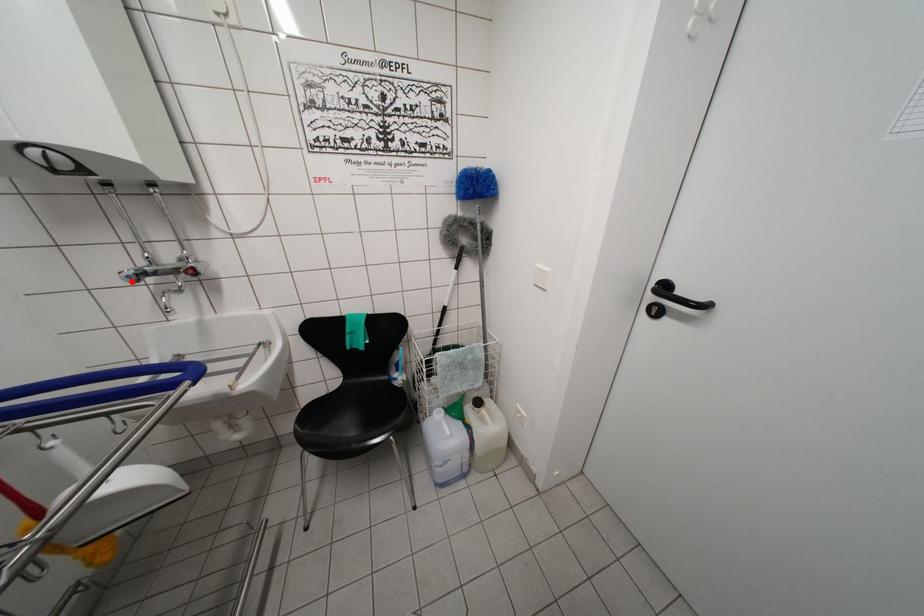
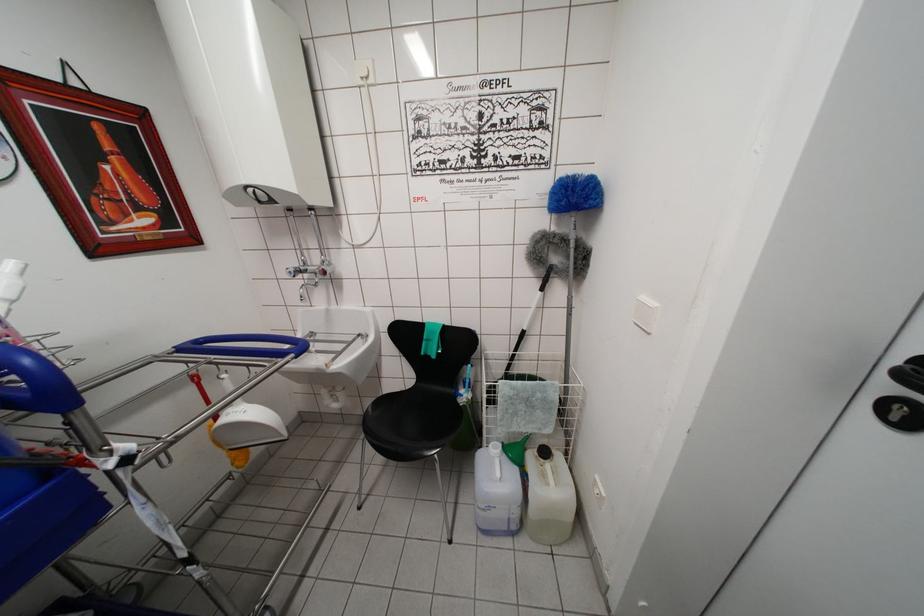
Find the pixel in the second image that matches the highlighted location in the first image.

(293, 277)